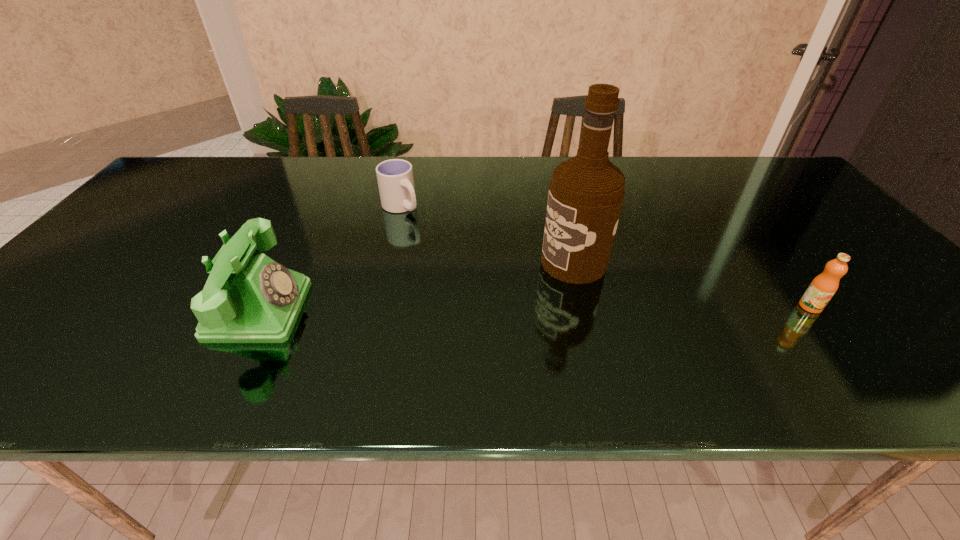
Where is `free space located with the handle on the side of the second object from left to right`? The width and height of the screenshot is (960, 540). free space located with the handle on the side of the second object from left to right is located at coordinates (432, 238).

Image resolution: width=960 pixels, height=540 pixels. I want to click on free spot located 0.170m with the handle on the side of the second object from left to right, so click(x=442, y=247).

Where is `vacant point located on the label of the alcohol`? Image resolution: width=960 pixels, height=540 pixels. vacant point located on the label of the alcohol is located at coordinates (411, 334).

Image resolution: width=960 pixels, height=540 pixels. Identify the location of free space located on the label of the alcohol. (520, 286).

Where is `blank area located on the label of the alcohol`? The width and height of the screenshot is (960, 540). blank area located on the label of the alcohol is located at coordinates (481, 303).

Where is `object located at the near edge`? This screenshot has width=960, height=540. object located at the near edge is located at coordinates (248, 298).

In the image, there is a desktop. Where is `vacant region at the far edge`? Image resolution: width=960 pixels, height=540 pixels. vacant region at the far edge is located at coordinates click(516, 159).

The image size is (960, 540). I want to click on free location at the near edge of the desktop, so click(x=458, y=320).

Find the location of a particular element. This screenshot has width=960, height=540. vacant space at the left edge is located at coordinates (182, 198).

Find the location of a particular element. free space at the near left corner of the desktop is located at coordinates (31, 329).